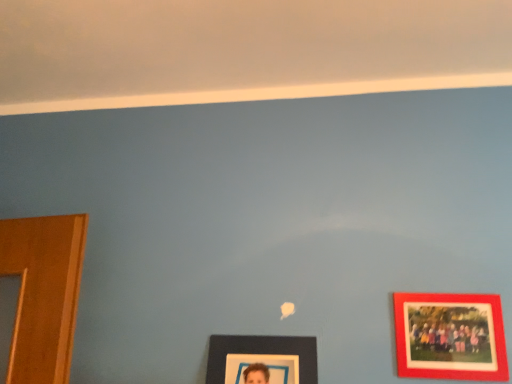
Question: Should I look upward or downward to see red matte picture frame at right, the first picture frame from the right?

Choices:
 (A) up
 (B) down

Answer: (B)

Question: Does red matte picture frame at right, the first picture frame from the right, lie behind matte black picture frame at lower center, which is the 2th picture frame in right-to-left order?

Choices:
 (A) yes
 (B) no

Answer: (A)

Question: Can you confirm if red matte picture frame at right, which is the second picture frame from left to right, is wider than matte black picture frame at lower center, which is the 2th picture frame in right-to-left order?

Choices:
 (A) no
 (B) yes

Answer: (A)

Question: Can you confirm if red matte picture frame at right, which is the second picture frame from left to right, is bigger than matte black picture frame at lower center, the first picture frame viewed from the left?

Choices:
 (A) no
 (B) yes

Answer: (A)

Question: From a real-world perspective, is red matte picture frame at right, which is the second picture frame from left to right, positioned under matte black picture frame at lower center, the first picture frame viewed from the left, based on gravity?

Choices:
 (A) no
 (B) yes

Answer: (A)

Question: Considering the relative sizes of red matte picture frame at right, the first picture frame from the right, and matte black picture frame at lower center, the first picture frame viewed from the left, in the image provided, is red matte picture frame at right, the first picture frame from the right, shorter than matte black picture frame at lower center, the first picture frame viewed from the left,?

Choices:
 (A) no
 (B) yes

Answer: (B)

Question: Does red matte picture frame at right, the first picture frame from the right, have a smaller size compared to matte black picture frame at lower center, which is the 2th picture frame in right-to-left order?

Choices:
 (A) yes
 (B) no

Answer: (A)

Question: From a real-world perspective, is matte black picture frame at lower center, which is the 2th picture frame in right-to-left order, physically below red matte picture frame at right, the first picture frame from the right?

Choices:
 (A) yes
 (B) no

Answer: (A)

Question: Is matte black picture frame at lower center, which is the 2th picture frame in right-to-left order, at the right side of red matte picture frame at right, which is the second picture frame from left to right?

Choices:
 (A) no
 (B) yes

Answer: (A)

Question: Is matte black picture frame at lower center, the first picture frame viewed from the left, thinner than red matte picture frame at right, the first picture frame from the right?

Choices:
 (A) no
 (B) yes

Answer: (A)

Question: Does matte black picture frame at lower center, the first picture frame viewed from the left, have a smaller size compared to red matte picture frame at right, which is the second picture frame from left to right?

Choices:
 (A) no
 (B) yes

Answer: (A)

Question: Is the position of matte black picture frame at lower center, which is the 2th picture frame in right-to-left order, more distant than that of red matte picture frame at right, which is the second picture frame from left to right?

Choices:
 (A) yes
 (B) no

Answer: (B)

Question: Does matte black picture frame at lower center, the first picture frame viewed from the left, have a greater height compared to red matte picture frame at right, the first picture frame from the right?

Choices:
 (A) no
 (B) yes

Answer: (B)

Question: Looking at the image, does red matte picture frame at right, which is the second picture frame from left to right, seem bigger or smaller compared to matte black picture frame at lower center, which is the 2th picture frame in right-to-left order?

Choices:
 (A) small
 (B) big

Answer: (A)